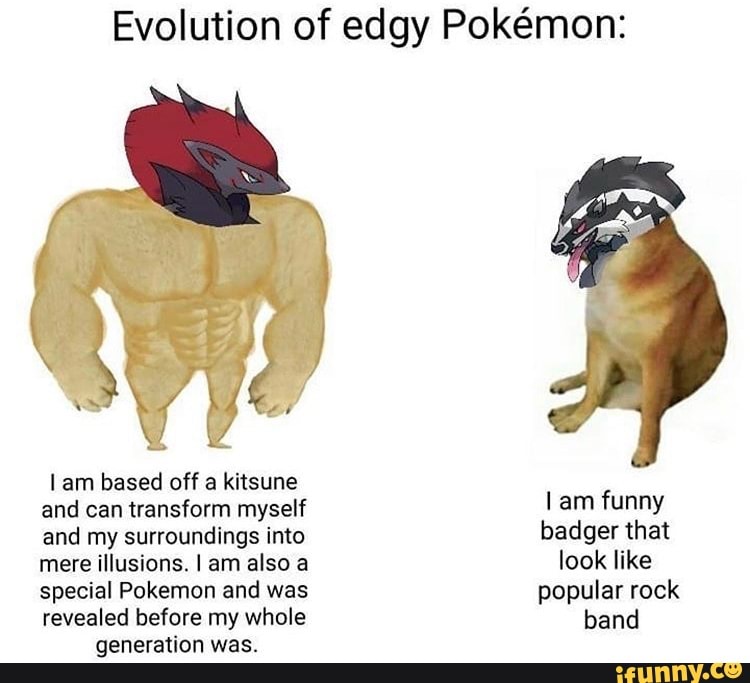
The width and height of the screenshot is (750, 683). In order to click on the chest in this screenshot , I will do `click(184, 281)`, `click(232, 277)`.